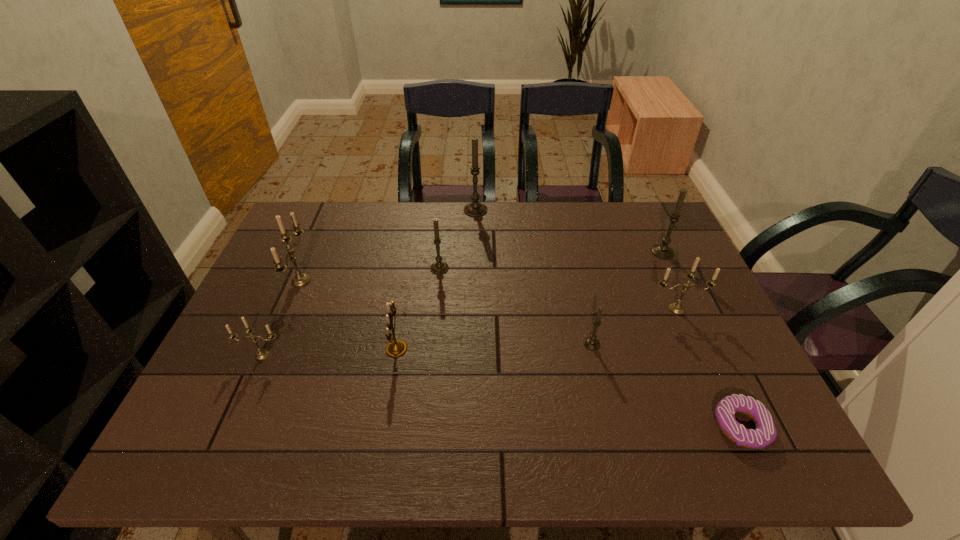
Locate an element on the screen. This screenshot has height=540, width=960. free space located 0.290m on the back of the gold candelabrum is located at coordinates (412, 259).

Locate an element on the screen. free region located on the right of the smallest gray candle is located at coordinates (677, 344).

Identify the location of vacant point located on the back of the nearest metallic candle. (299, 273).

The height and width of the screenshot is (540, 960). What are the coordinates of `vacant space located on the left of the doughnut` in the screenshot? It's located at (637, 427).

The width and height of the screenshot is (960, 540). In order to click on object located at the near edge in this screenshot , I will do `click(765, 433)`.

Identify the location of doughnut located at the right edge. (765, 433).

You are a GUI agent. You are given a task and a screenshot of the screen. Output one action in this format:
    pyautogui.click(x=<x>, y=<y>)
    Task: Click on the object that is at the far right corner
    The width and height of the screenshot is (960, 540).
    Given the screenshot: What is the action you would take?
    pos(663,251)

You are a GUI agent. You are given a task and a screenshot of the screen. Output one action in this format:
    pyautogui.click(x=<x>, y=<y>)
    Task: Click on the object present at the near right corner
    This screenshot has height=540, width=960.
    Given the screenshot: What is the action you would take?
    pyautogui.click(x=765, y=433)

I want to click on free spot at the far edge of the desktop, so click(x=444, y=232).

This screenshot has height=540, width=960. In the image, there is a desktop. Identify the location of vacant region at the near edge. (367, 447).